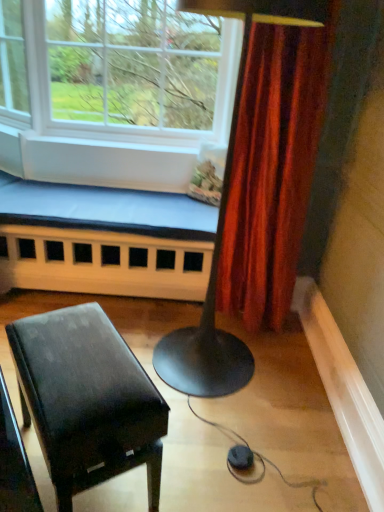
Question: Should I look upward or downward to see white wood church bench at lower left?

Choices:
 (A) down
 (B) up

Answer: (B)

Question: Does glossy black piano at lower left have a greater width compared to clear glass window at upper left?

Choices:
 (A) yes
 (B) no

Answer: (B)

Question: Considering the relative sizes of glossy black piano at lower left and clear glass window at upper left in the image provided, is glossy black piano at lower left taller than clear glass window at upper left?

Choices:
 (A) yes
 (B) no

Answer: (B)

Question: Is the depth of glossy black piano at lower left less than that of clear glass window at upper left?

Choices:
 (A) yes
 (B) no

Answer: (A)

Question: Is the depth of glossy black piano at lower left greater than that of clear glass window at upper left?

Choices:
 (A) yes
 (B) no

Answer: (B)

Question: Considering the relative sizes of glossy black piano at lower left and clear glass window at upper left in the image provided, is glossy black piano at lower left smaller than clear glass window at upper left?

Choices:
 (A) yes
 (B) no

Answer: (A)

Question: Are glossy black piano at lower left and clear glass window at upper left located far from each other?

Choices:
 (A) yes
 (B) no

Answer: (A)

Question: Is clear glass window at upper left oriented away from white wood church bench at lower left?

Choices:
 (A) no
 (B) yes

Answer: (A)

Question: From a real-world perspective, is clear glass window at upper left physically below white wood church bench at lower left?

Choices:
 (A) no
 (B) yes

Answer: (A)

Question: From the image's perspective, is clear glass window at upper left beneath white wood church bench at lower left?

Choices:
 (A) no
 (B) yes

Answer: (A)

Question: Considering the relative sizes of clear glass window at upper left and white wood church bench at lower left in the image provided, is clear glass window at upper left bigger than white wood church bench at lower left?

Choices:
 (A) no
 (B) yes

Answer: (B)

Question: Is clear glass window at upper left far away from white wood church bench at lower left?

Choices:
 (A) no
 (B) yes

Answer: (A)

Question: Can you confirm if clear glass window at upper left is positioned to the right of white wood church bench at lower left?

Choices:
 (A) no
 (B) yes

Answer: (A)

Question: Considering the relative sizes of clear glass window at upper left and glossy black piano at lower left in the image provided, is clear glass window at upper left bigger than glossy black piano at lower left?

Choices:
 (A) no
 (B) yes

Answer: (B)